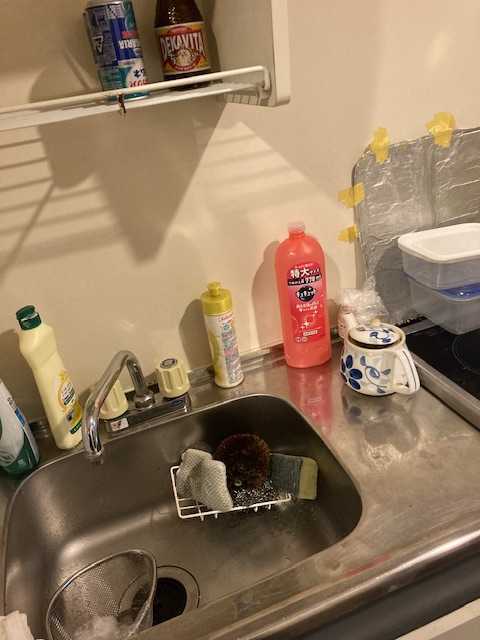
This screenshot has height=640, width=480. In order to click on tupperware in this screenshot , I will do `click(447, 235)`.